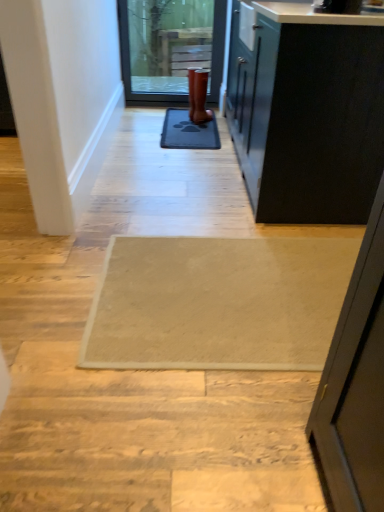
Question: Is white smooth door at left turned away from beige textured rug at center?

Choices:
 (A) yes
 (B) no

Answer: (B)

Question: Is white smooth door at left positioned beyond the bounds of beige textured rug at center?

Choices:
 (A) yes
 (B) no

Answer: (A)

Question: Is white smooth door at left closer to the viewer compared to beige textured rug at center?

Choices:
 (A) no
 (B) yes

Answer: (B)

Question: From a real-world perspective, is white smooth door at left beneath beige textured rug at center?

Choices:
 (A) no
 (B) yes

Answer: (A)

Question: Is white smooth door at left beside beige textured rug at center?

Choices:
 (A) no
 (B) yes

Answer: (A)

Question: Considering the relative sizes of white smooth door at left and beige textured rug at center in the image provided, is white smooth door at left smaller than beige textured rug at center?

Choices:
 (A) no
 (B) yes

Answer: (A)

Question: From a real-world perspective, is beige textured rug at center physically below white smooth door at left?

Choices:
 (A) yes
 (B) no

Answer: (A)

Question: Can you confirm if beige textured rug at center is wider than white smooth door at left?

Choices:
 (A) yes
 (B) no

Answer: (A)

Question: Is beige textured rug at center to the right of white smooth door at left from the viewer's perspective?

Choices:
 (A) no
 (B) yes

Answer: (B)

Question: From the image's perspective, is beige textured rug at center beneath white smooth door at left?

Choices:
 (A) yes
 (B) no

Answer: (A)

Question: From a real-world perspective, is beige textured rug at center on white smooth door at left?

Choices:
 (A) yes
 (B) no

Answer: (B)

Question: Is beige textured rug at center turned away from white smooth door at left?

Choices:
 (A) yes
 (B) no

Answer: (B)

Question: Is rubber boot at center placed right next to black rubber mat at center?

Choices:
 (A) no
 (B) yes

Answer: (A)